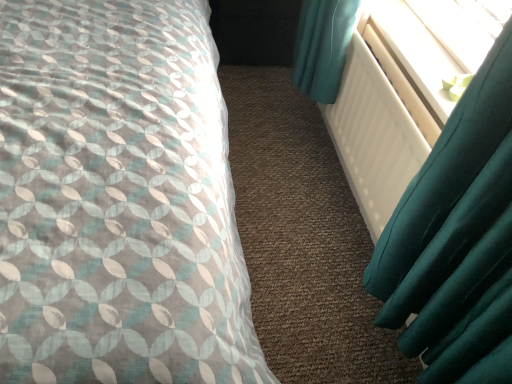
Question: Is white plastic radiator at upper right aimed at white matte radiator at right?

Choices:
 (A) yes
 (B) no

Answer: (A)

Question: Is white plastic radiator at upper right smaller than white matte radiator at right?

Choices:
 (A) no
 (B) yes

Answer: (B)

Question: Is white plastic radiator at upper right in front of white matte radiator at right?

Choices:
 (A) yes
 (B) no

Answer: (B)

Question: Is white matte radiator at right at the back of white plastic radiator at upper right?

Choices:
 (A) yes
 (B) no

Answer: (B)

Question: Can you confirm if white plastic radiator at upper right is positioned to the right of white matte radiator at right?

Choices:
 (A) no
 (B) yes

Answer: (B)

Question: From the image's perspective, relative to white plastic radiator at upper right, is white matte radiator at right above or below?

Choices:
 (A) below
 (B) above

Answer: (A)

Question: In terms of size, does white matte radiator at right appear bigger or smaller than white plastic radiator at upper right?

Choices:
 (A) small
 (B) big

Answer: (B)

Question: From a real-world perspective, is white matte radiator at right above or below white plastic radiator at upper right?

Choices:
 (A) below
 (B) above

Answer: (A)

Question: In the image, is white matte radiator at right positioned in front of or behind white plastic radiator at upper right?

Choices:
 (A) front
 (B) behind

Answer: (A)

Question: Considering the positions of patterned fabric bed at left and black matte box at center in the image, is patterned fabric bed at left bigger or smaller than black matte box at center?

Choices:
 (A) small
 (B) big

Answer: (B)

Question: From a real-world perspective, relative to black matte box at center, is patterned fabric bed at left vertically above or below?

Choices:
 (A) below
 (B) above

Answer: (B)

Question: Would you say patterned fabric bed at left is inside or outside black matte box at center?

Choices:
 (A) inside
 (B) outside

Answer: (B)

Question: Looking at their shapes, would you say patterned fabric bed at left is wider or thinner than black matte box at center?

Choices:
 (A) thin
 (B) wide

Answer: (B)

Question: In the image, is white matte radiator at right on the left side or the right side of patterned fabric bed at left?

Choices:
 (A) left
 (B) right

Answer: (B)

Question: From the image's perspective, is white matte radiator at right positioned above or below patterned fabric bed at left?

Choices:
 (A) above
 (B) below

Answer: (B)